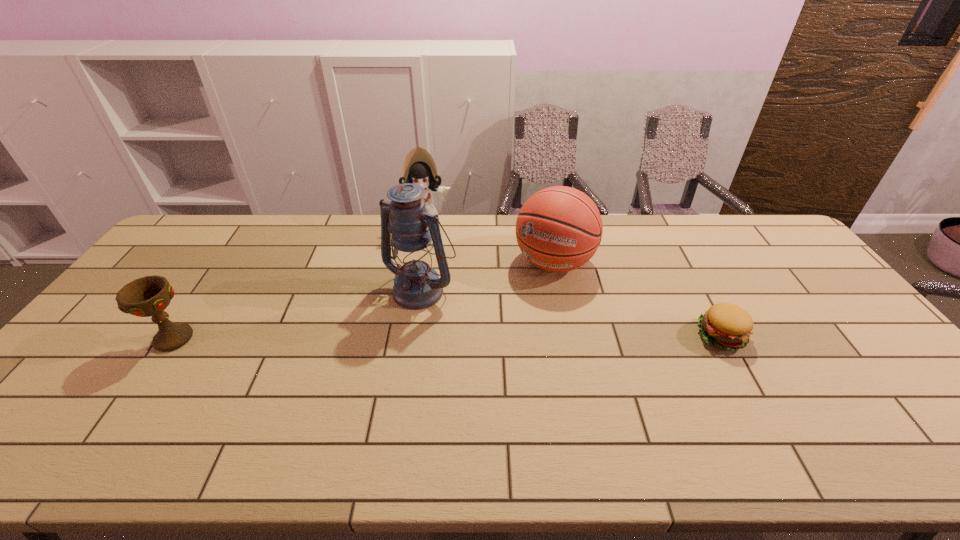
Identify the location of vacant space on the desktop that is between the chalice and the rightmost object and is positioned on the logo side of the fourth object from left to right. (506, 337).

This screenshot has width=960, height=540. In order to click on free space on the desktop that is between the second shortest object and the shortest object and is positioned on the front-facing side of the lantern in this screenshot , I will do `click(376, 338)`.

You are a GUI agent. You are given a task and a screenshot of the screen. Output one action in this format:
    pyautogui.click(x=<x>, y=<y>)
    Task: Click on the free space on the desktop that is between the leftmost object and the rightmost object and is positioned at the front face of the farthest object
    This screenshot has width=960, height=540.
    Given the screenshot: What is the action you would take?
    pyautogui.click(x=426, y=338)